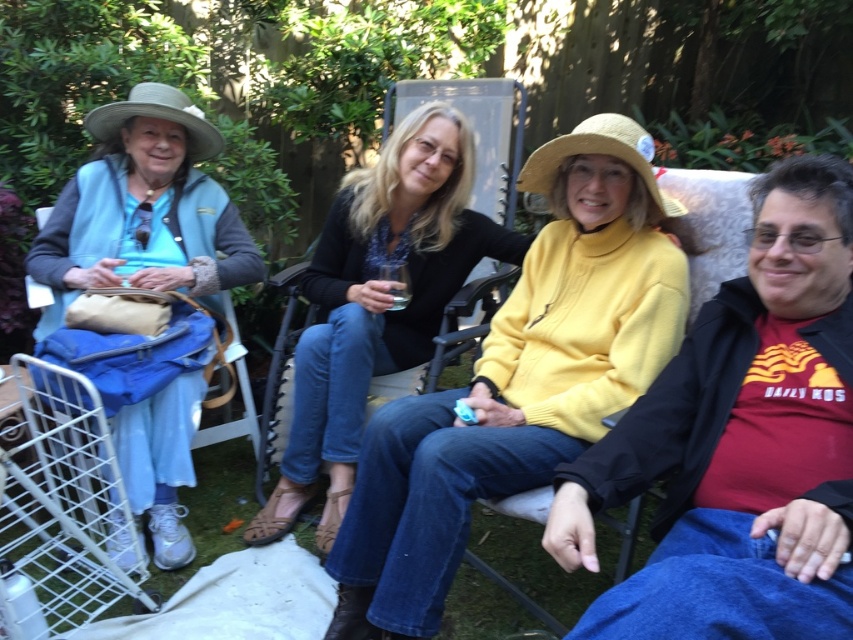
You are an observer looking at the group of four people in the garden. Which of the two sweaters, the yellow turtleneck sweater at center or the yellow woolen sweater at center, is positioned lower on the person?

The yellow turtleneck sweater at center is positioned lower because it is below the yellow woolen sweater at center.

You are standing in the garden and want to place a small decoration between the two points, point (410, 301) and point (128, 99). Which point should you place it closer to so it appears larger in the image?

You should place the decoration closer to point (410, 301) because it is closer to the viewer, making the decoration appear larger in the image.